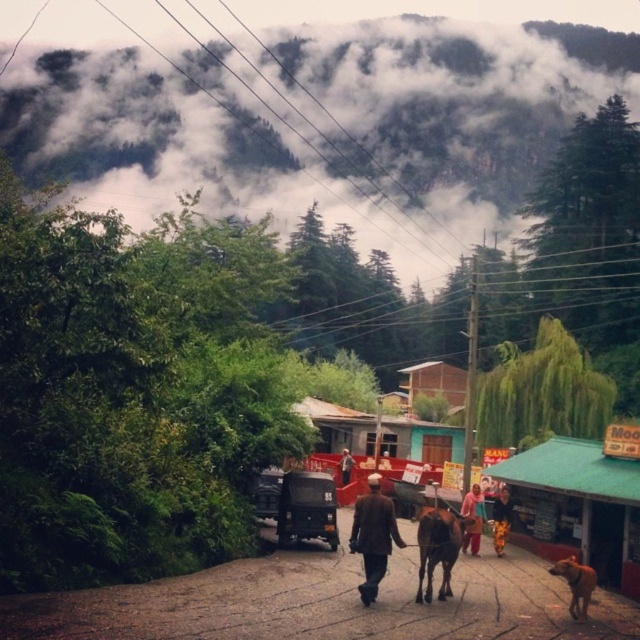
You are a traveler on the road and see the multicolored fabric at center and the metallic gray truck at center. Which object is positioned to the right side of the other?

The multicolored fabric at center is to the right of the metallic gray truck at center.

You are standing at the point marked by the coordinates point (465, 502) in the image. You want to walk to the nearest building with a colorful facade on the right side of the road. How far will you have to walk to reach it?

The point (465, 502) is 24.46 meters away from the viewer. Since the buildings with colorful facades are on the right side of the road in the foreground, you would need to walk approximately 24.46 meters to reach the nearest one.

You are a hiker planning to cross the road between the dark brown woolen coat at center and the metallic gray truck at center. The road is 30 feet wide. Can you safely cross without stepping into the road?

The distance between the dark brown woolen coat at center and the metallic gray truck at center is 30.64 feet, which is slightly longer than the 30 feet road width. Therefore, you can safely cross between them without stepping into the road.